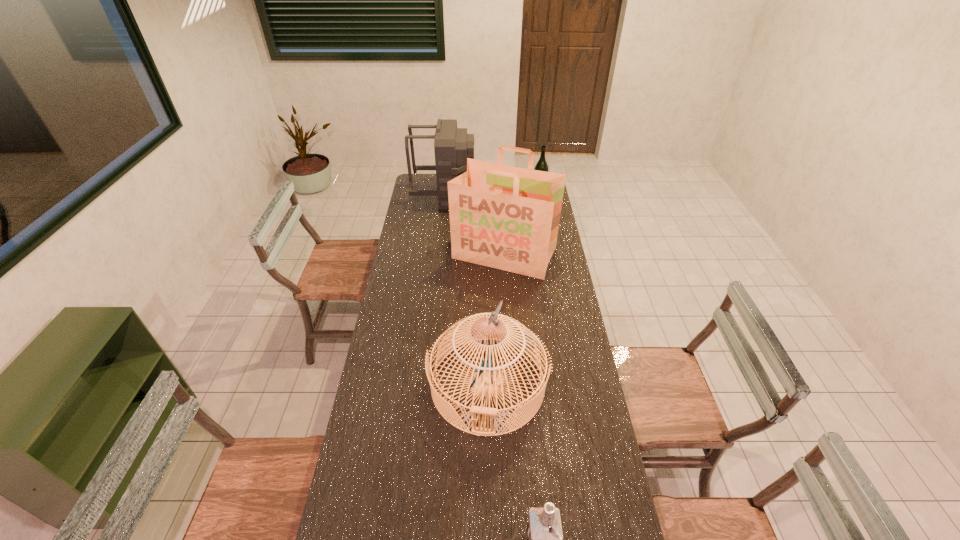
Locate an element on the screen. free area in between the backpack and the birdcage is located at coordinates (467, 289).

This screenshot has width=960, height=540. Identify the location of empty space that is in between the backpack and the birdcage. (467, 289).

You are a GUI agent. You are given a task and a screenshot of the screen. Output one action in this format:
    pyautogui.click(x=<x>, y=<y>)
    Task: Click on the vacant space that's between the fourth farthest object and the backpack
    
    Given the screenshot: What is the action you would take?
    pyautogui.click(x=467, y=289)

You are a GUI agent. You are given a task and a screenshot of the screen. Output one action in this format:
    pyautogui.click(x=<x>, y=<y>)
    Task: Click on the object that stands as the closest to the wine bottle
    The image size is (960, 540).
    Given the screenshot: What is the action you would take?
    pyautogui.click(x=504, y=217)

Where is `object that stands as the third closest to the nearest object`? This screenshot has width=960, height=540. object that stands as the third closest to the nearest object is located at coordinates (452, 146).

This screenshot has height=540, width=960. I want to click on free space that satisfies the following two spatial constraints: 1. on the front compartment of the backpack; 2. on the back side of the second nearest object, so click(423, 384).